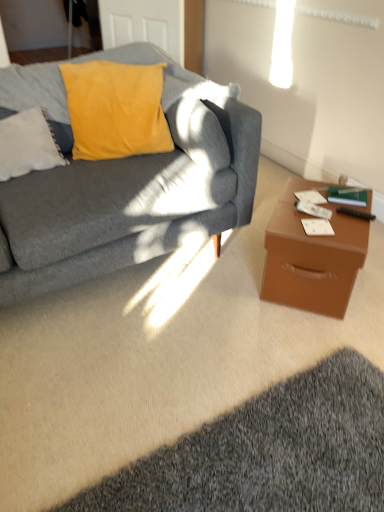
You are a GUI agent. You are given a task and a screenshot of the screen. Output one action in this format:
    pyautogui.click(x=<x>, y=<y>)
    Task: Click on the free space on the front side of green matte book at right
    The width and height of the screenshot is (384, 512).
    Given the screenshot: What is the action you would take?
    pyautogui.click(x=347, y=219)